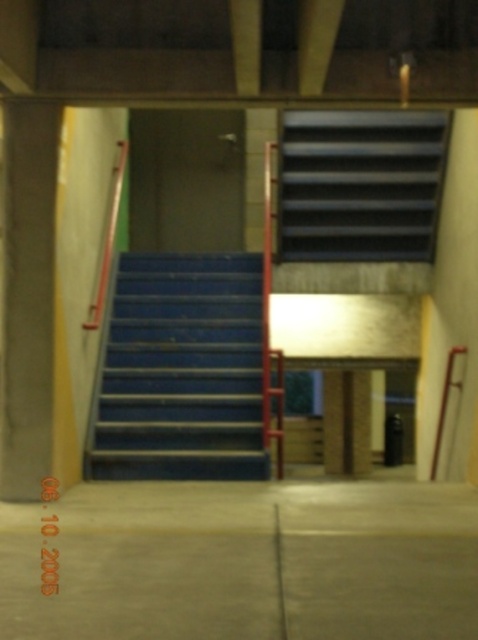
Can you confirm if blue painted metal stairs at center is positioned below metallic silver ladder at right?

Actually, blue painted metal stairs at center is above metallic silver ladder at right.

Which is behind, point (234, 316) or point (438, 440)?

The point (234, 316) is more distant.

Find the location of a particular element. This screenshot has height=640, width=478. blue painted metal stairs at center is located at coordinates (182, 371).

Looking at this image, is blue painted metal stairs at center further to the viewer compared to blue rubber stairs at upper center?

No, blue painted metal stairs at center is closer to the viewer.

Between blue painted metal stairs at center and blue rubber stairs at upper center, which one is positioned lower?

Positioned lower is blue painted metal stairs at center.

The width and height of the screenshot is (478, 640). Identify the location of blue painted metal stairs at center. (182, 371).

Image resolution: width=478 pixels, height=640 pixels. I want to click on blue painted metal stairs at center, so click(x=182, y=371).

Who is taller, blue rubber stairs at upper center or metallic silver ladder at right?

blue rubber stairs at upper center is taller.

Which is below, blue rubber stairs at upper center or metallic silver ladder at right?

metallic silver ladder at right is below.

Is point (400, 186) closer to viewer compared to point (435, 467)?

That is False.

Find the location of a particular element. This screenshot has height=640, width=478. blue rubber stairs at upper center is located at coordinates (359, 182).